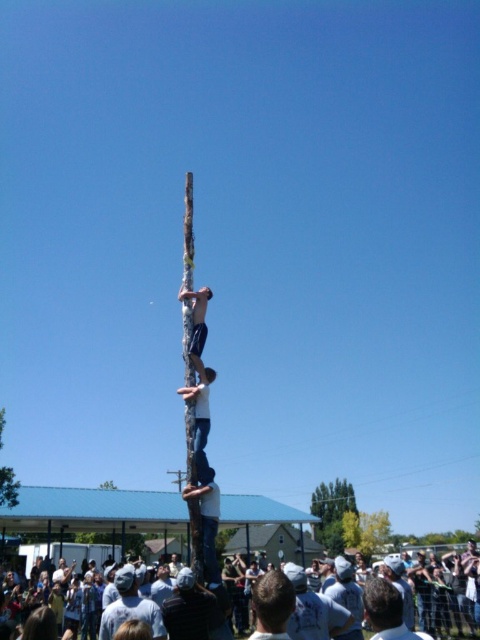
Question: Is smooth wood totem pole at center to the right of white cotton shirt at lower center from the viewer's perspective?

Choices:
 (A) no
 (B) yes

Answer: (A)

Question: Considering the real-world distances, which object is farthest from the dark gray shirt at lower center?

Choices:
 (A) white cotton shirt at lower center
 (B) white cotton crowd at lower center

Answer: (B)

Question: Does smooth wood totem pole at center lie behind dark gray shirt at lower center?

Choices:
 (A) no
 (B) yes

Answer: (B)

Question: Estimate the real-world distances between objects in this image. Which object is farther from the smooth wood totem pole at center?

Choices:
 (A) dark gray shirt at lower center
 (B) white matte shirt at lower center
 (C) white cotton shirt at lower center
 (D) white cotton crowd at lower center

Answer: (B)

Question: Does white cotton crowd at lower center have a greater width compared to white matte shirt at lower center?

Choices:
 (A) no
 (B) yes

Answer: (B)

Question: Considering the real-world distances, which object is farthest from the dark gray shirt at lower center?

Choices:
 (A) white matte shirt at lower center
 (B) white cotton crowd at lower center
 (C) smooth wood totem pole at center

Answer: (C)